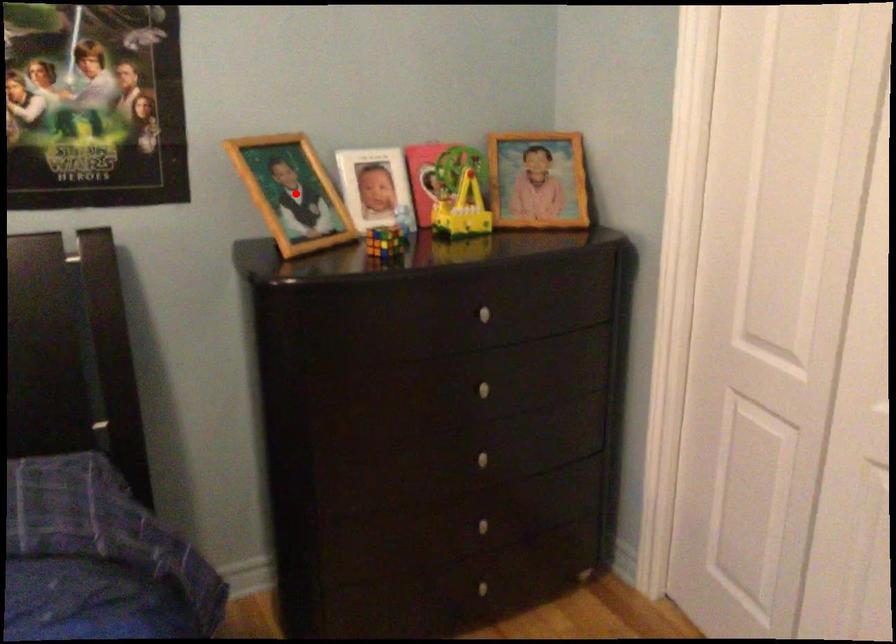
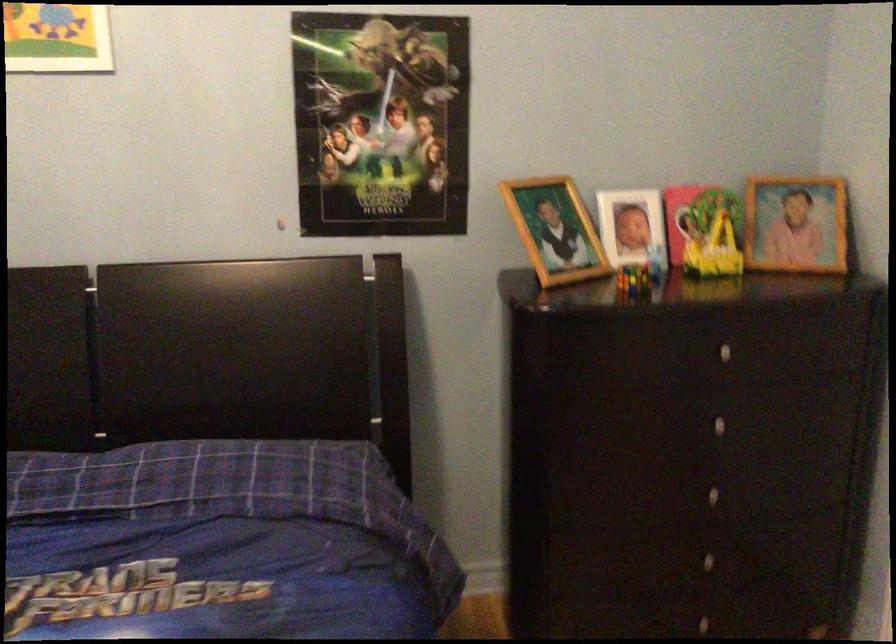
Question: I am providing you with two images of the same scene from different viewpoints. Given a red point in image1, look at the same physical point in image2. Is it:

Choices:
 (A) Closer to the viewpoint
 (B) Farther from the viewpoint

Answer: (B)